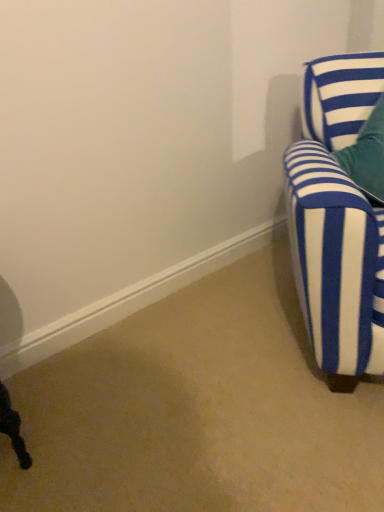
At what (x,y) coordinates should I click in order to perform the action: click on blue and white striped fabric chair at right. Please return your answer as a coordinate pair (x, y). Looking at the image, I should click on (337, 221).

This screenshot has width=384, height=512. Describe the element at coordinates (337, 221) in the screenshot. I see `blue and white striped fabric chair at right` at that location.

The width and height of the screenshot is (384, 512). Find the location of `blue and white striped fabric chair at right`. blue and white striped fabric chair at right is located at coordinates (337, 221).